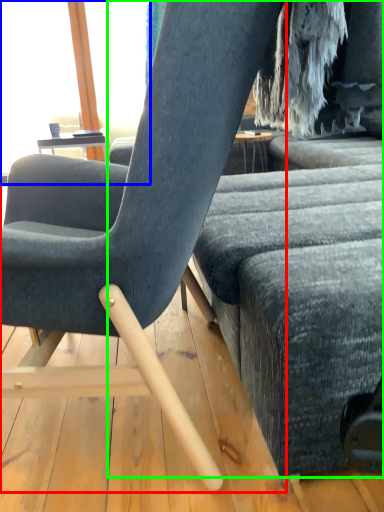
Question: Which is nearer to the chair (highlighted by a red box)? window screen (highlighted by a blue box) or studio couch (highlighted by a green box).

Choices:
 (A) window screen
 (B) studio couch

Answer: (B)